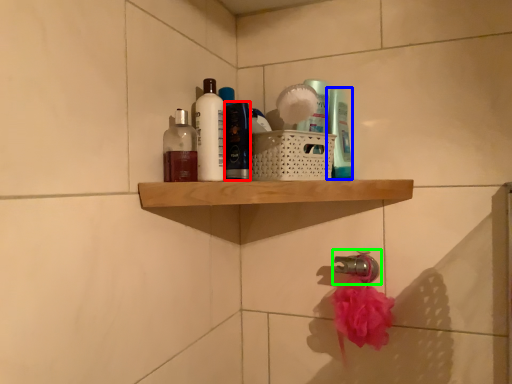
Question: Which is farther away from toiletry (highlighted by a red box)? toiletry (highlighted by a blue box) or tap (highlighted by a green box)?

Choices:
 (A) toiletry
 (B) tap

Answer: (B)